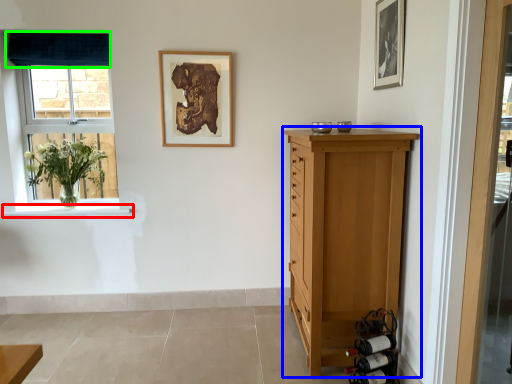
Question: Which object is the farthest from window sill (highlighted by a red box)? Choose among these: chest of drawers (highlighted by a blue box) or curtain (highlighted by a green box).

Choices:
 (A) chest of drawers
 (B) curtain

Answer: (A)